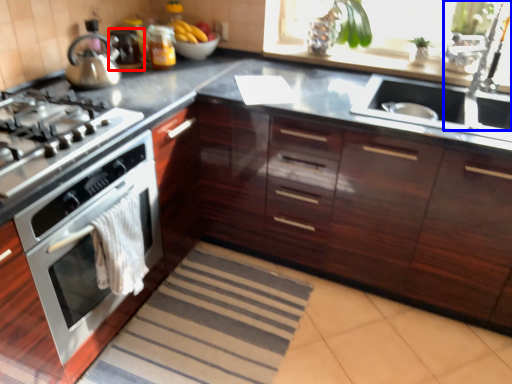
Question: Which object is closer to the camera taking this photo, appliance (highlighted by a red box) or faucet (highlighted by a blue box)?

Choices:
 (A) appliance
 (B) faucet

Answer: (B)